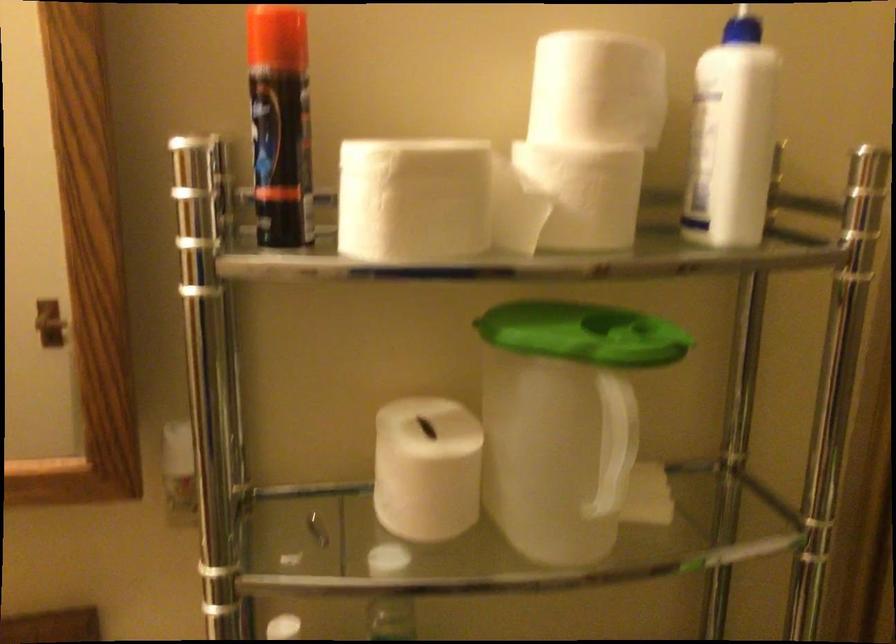
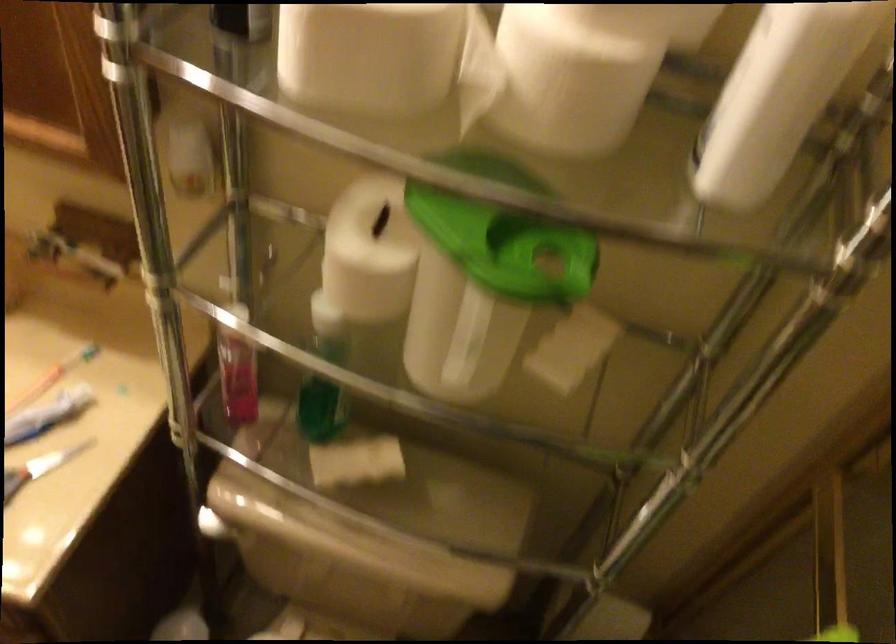
Where in the second image is the point corresponding to point 441,451 from the first image?

(369, 252)